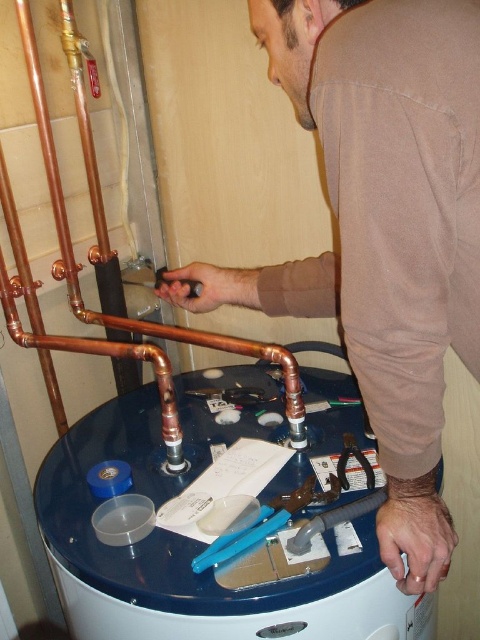
Question: Which of the following is the farthest from the observer?

Choices:
 (A) (389, 352)
 (B) (39, 88)
 (C) (196, 435)

Answer: (C)

Question: Can you confirm if brown cotton shirt at center is positioned to the left of copper pipe at left?

Choices:
 (A) yes
 (B) no

Answer: (B)

Question: In this image, where is brown cotton shirt at center located relative to copper pipe at left?

Choices:
 (A) left
 (B) right

Answer: (B)

Question: Among these objects, which one is farthest from the camera?

Choices:
 (A) brown cotton shirt at center
 (B) copper pipe at left

Answer: (B)

Question: Among these objects, which one is farthest from the camera?

Choices:
 (A) blue glossy water tank at center
 (B) brown cotton shirt at center
 (C) copper pipe at left

Answer: (C)

Question: Can you confirm if brown cotton shirt at center is positioned to the right of copper pipe at left?

Choices:
 (A) no
 (B) yes

Answer: (B)